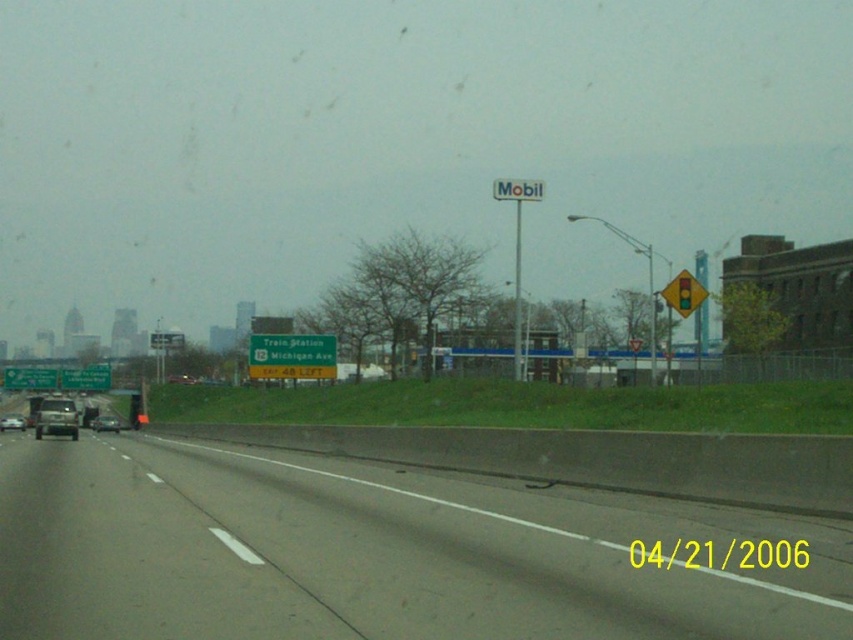
Question: Considering the real-world distances, which object is closest to the gray asphalt highway at center?

Choices:
 (A) metallic silver sedan at center
 (B) metallic silver sedan at left

Answer: (B)

Question: Can you confirm if white plastic mobil sign at upper center is thinner than green metallic sign at upper center?

Choices:
 (A) no
 (B) yes

Answer: (B)

Question: Which is nearer to the greenmaterial/texturesign at left?

Choices:
 (A) transparent glass windshield at left
 (B) gray asphalt highway at center
 (C) white plastic mobil sign at upper center

Answer: (A)

Question: Can you confirm if greenmaterial/texturesign at left is bigger than matte black car at left?

Choices:
 (A) yes
 (B) no

Answer: (A)

Question: Which point is farther to the camera?

Choices:
 (A) (12, 428)
 (B) (94, 419)

Answer: (B)

Question: Does metallic silver sedan at left come in front of transparent glass windshield at left?

Choices:
 (A) yes
 (B) no

Answer: (A)